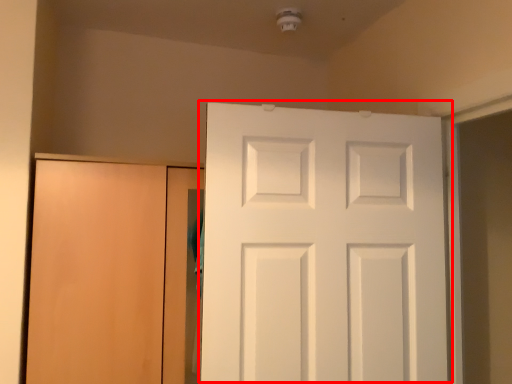
Question: In this image, where is door (annotated by the red box) located relative to door?

Choices:
 (A) right
 (B) left

Answer: (A)